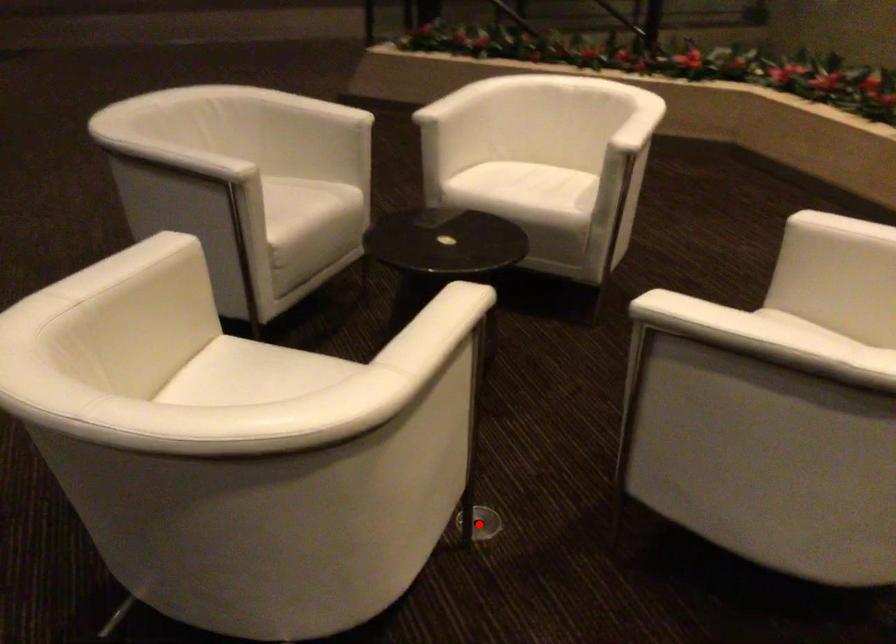
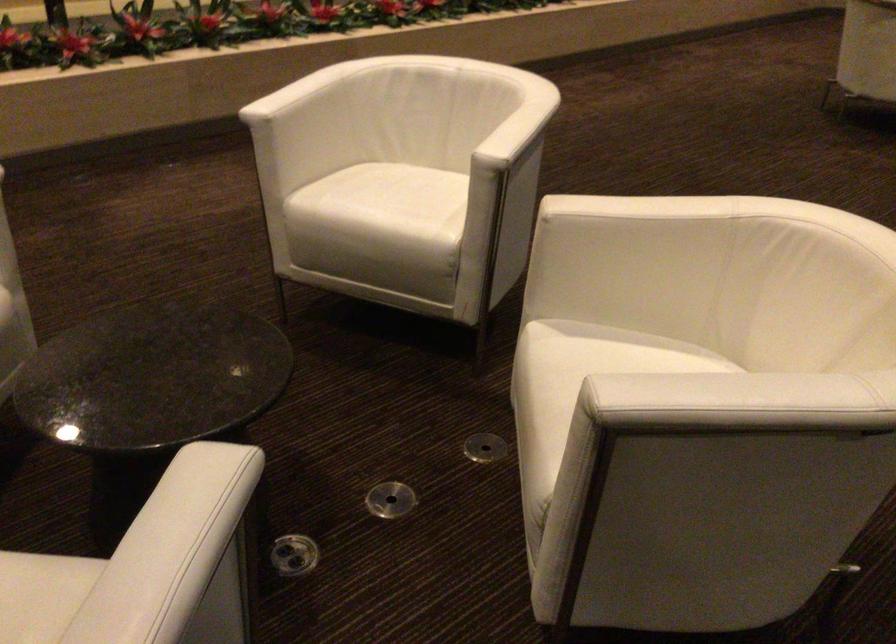
Where in the second image is the point corresponding to the highlighted location from the first image?

(484, 447)